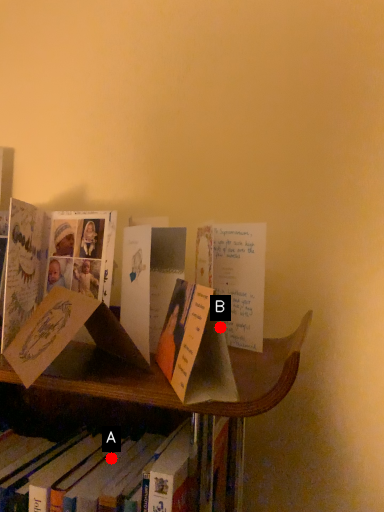
Question: Two points are circled on the image, labeled by A and B beside each circle. Which of the following is the closest to the observer?

Choices:
 (A) A is closer
 (B) B is closer

Answer: (B)